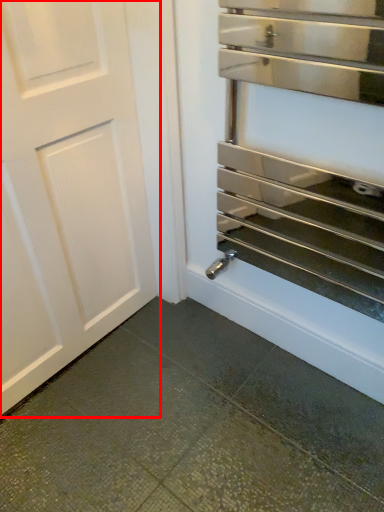
Question: Observing the image, what is the correct spatial positioning of door (annotated by the red box) in reference to oven?

Choices:
 (A) right
 (B) left

Answer: (B)